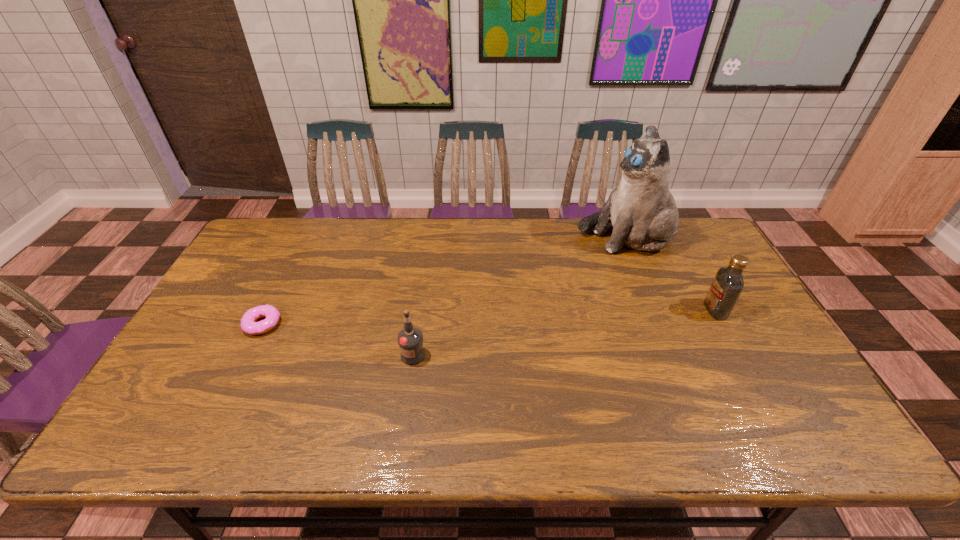
This screenshot has width=960, height=540. I want to click on the farthest object, so click(641, 208).

You are a GUI agent. You are given a task and a screenshot of the screen. Output one action in this format:
    pyautogui.click(x=<x>, y=<y>)
    Task: Click on the cat
    This screenshot has width=960, height=540.
    Given the screenshot: What is the action you would take?
    pyautogui.click(x=641, y=208)

Find the location of a particular element. the taller vodka is located at coordinates point(728,283).

Identify the location of the farther vodka. Image resolution: width=960 pixels, height=540 pixels. (728, 283).

Where is `the second shortest object`? This screenshot has height=540, width=960. the second shortest object is located at coordinates (410, 339).

Where is `the nearest object`? This screenshot has height=540, width=960. the nearest object is located at coordinates (410, 339).

Locate an element on the screen. the shortest object is located at coordinates (248, 324).

Locate an element on the screen. The height and width of the screenshot is (540, 960). the leftmost object is located at coordinates click(x=248, y=324).

Locate an element on the screen. This screenshot has width=960, height=540. vacant area situated 0.090m at the face of the cat is located at coordinates (551, 237).

Identify the location of free spot located 0.250m at the face of the cat. This screenshot has width=960, height=540. (505, 237).